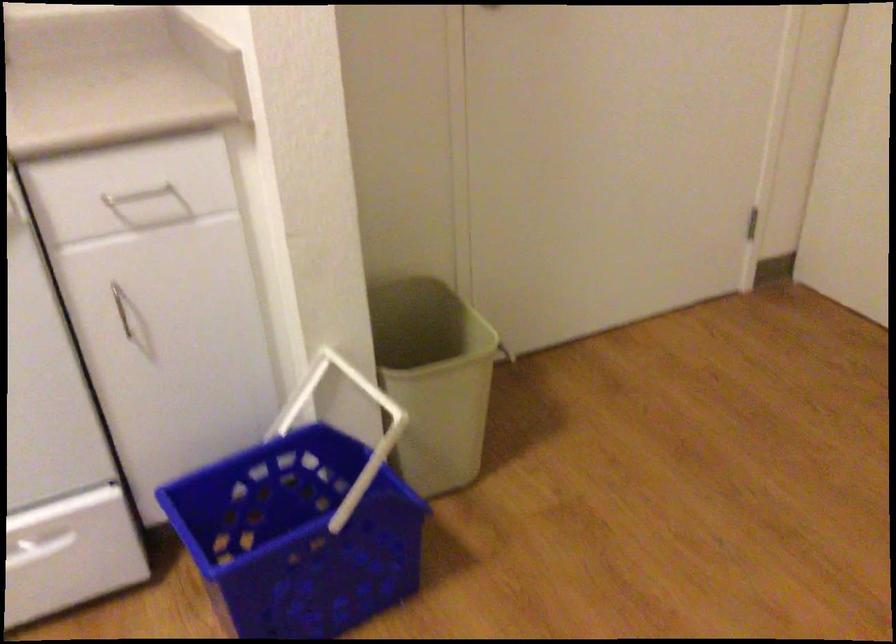
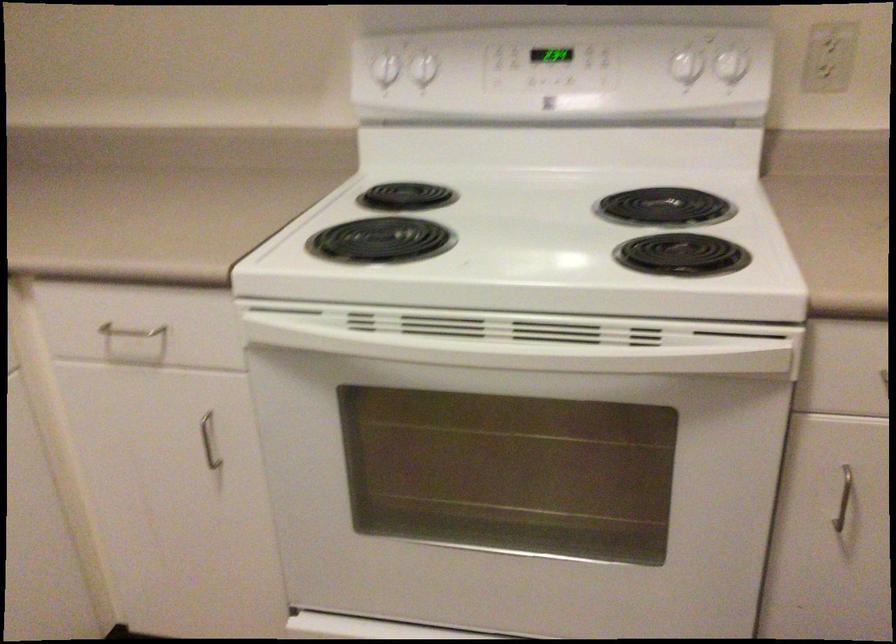
The point at (134, 314) is marked in the first image. Where is the corresponding point in the second image?

(842, 498)